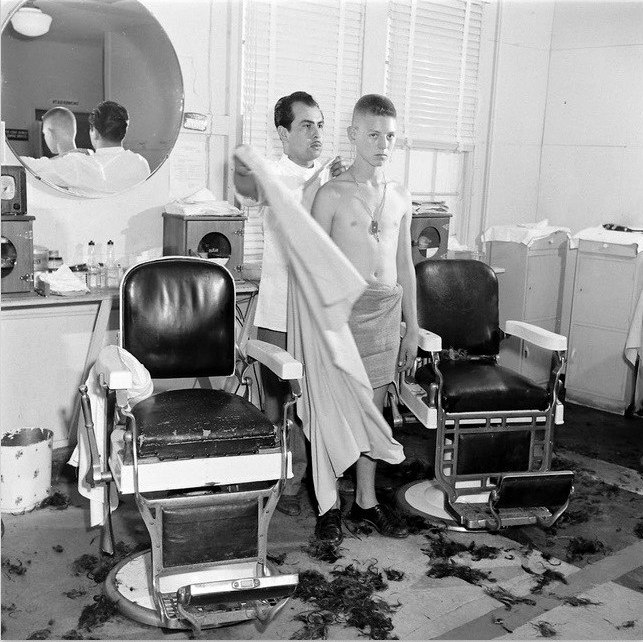
The height and width of the screenshot is (642, 643). Identify the location of chairs. (481, 365), (193, 406).